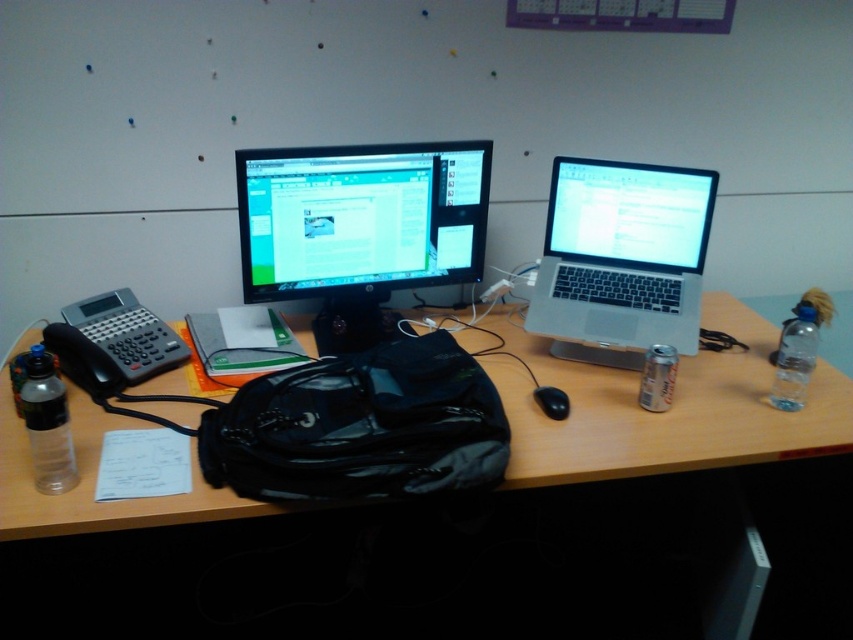
Is silver metallic laptop at center wider than black matte mouse at center?

Indeed, silver metallic laptop at center has a greater width compared to black matte mouse at center.

Consider the image. Can you confirm if silver metallic laptop at center is positioned below black matte mouse at center?

No, silver metallic laptop at center is not below black matte mouse at center.

The width and height of the screenshot is (853, 640). I want to click on silver metallic laptop at center, so click(x=621, y=259).

Based on the photo, can you confirm if clear plastic bottle at right is wider than black matte mouse at center?

Indeed, clear plastic bottle at right has a greater width compared to black matte mouse at center.

Can you confirm if clear plastic bottle at right is smaller than black matte mouse at center?

Incorrect, clear plastic bottle at right is not smaller in size than black matte mouse at center.

Which is in front, point (781, 410) or point (544, 388)?

Point (544, 388) is in front.

I want to click on clear plastic bottle at right, so click(x=793, y=358).

Does point (82, 515) lie behind point (332, 260)?

No, it is in front of (332, 260).

Is wooden desk at center smaller than matte black monitor at center?

Incorrect, wooden desk at center is not smaller in size than matte black monitor at center.

What do you see at coordinates (662, 413) in the screenshot? I see `wooden desk at center` at bounding box center [662, 413].

At what (x,y) coordinates should I click in order to perform the action: click on wooden desk at center. Please return your answer as a coordinate pair (x, y). This screenshot has height=640, width=853. Looking at the image, I should click on (662, 413).